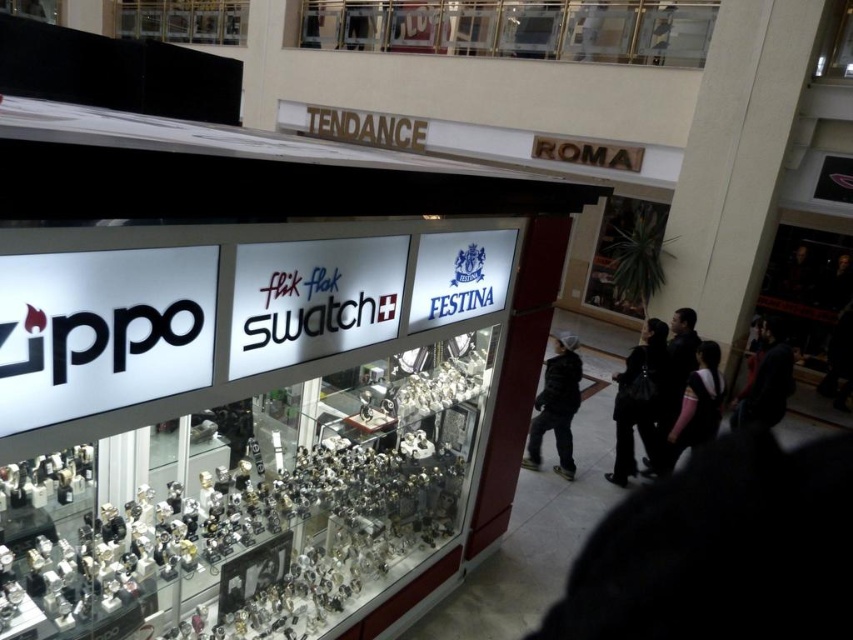
Can you confirm if black fabric bag at lower right is positioned above black fuzzy jacket at center?

Yes, black fabric bag at lower right is above black fuzzy jacket at center.

Between black fabric bag at lower right and black fuzzy jacket at center, which one appears on the left side from the viewer's perspective?

black fuzzy jacket at center is more to the left.

What are the coordinates of `black fabric bag at lower right` in the screenshot? It's located at (637, 401).

Measure the distance from black fabric bag at lower right to black fabric at lower right.

A distance of 4.58 feet exists between black fabric bag at lower right and black fabric at lower right.

Is black fabric bag at lower right positioned at the back of black fabric at lower right?

That is False.

Who is more forward, (662, 339) or (734, 413)?

Positioned in front is point (662, 339).

Identify the location of black fabric bag at lower right. The width and height of the screenshot is (853, 640). (637, 401).

Can you confirm if black fuzzy jacket at center is taller than black fabric at lower right?

Indeed, black fuzzy jacket at center has a greater height compared to black fabric at lower right.

Which is in front, point (546, 417) or point (769, 374)?

Point (546, 417) is in front.

Locate an element on the screen. This screenshot has height=640, width=853. black fuzzy jacket at center is located at coordinates (556, 406).